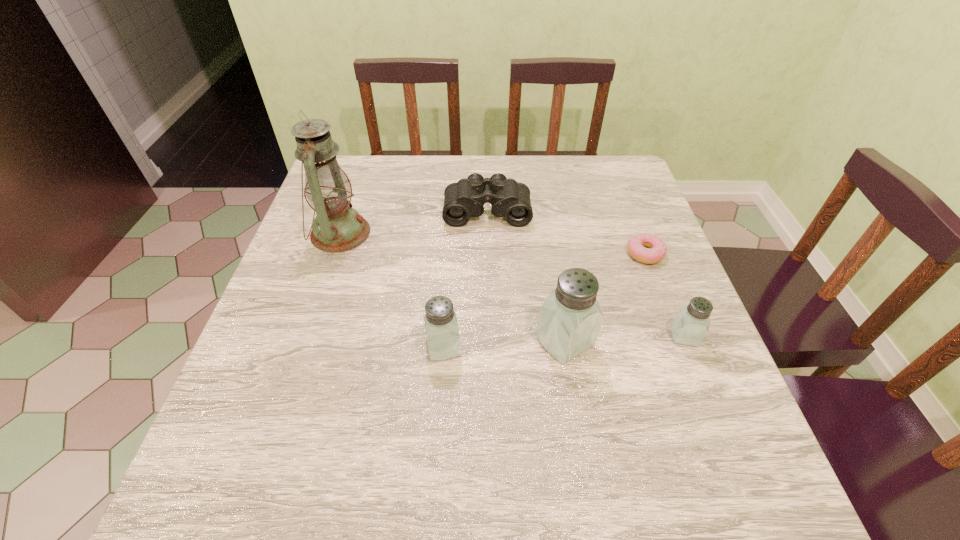
The width and height of the screenshot is (960, 540). Identify the location of vacant area that lies between the tallest saltshaker and the second shortest saltshaker. (504, 344).

This screenshot has width=960, height=540. In order to click on empty location between the shortest object and the oil lamp in this screenshot , I will do `click(492, 244)`.

This screenshot has height=540, width=960. What are the coordinates of `vacant space in between the binoculars and the doughnut` in the screenshot? It's located at (566, 232).

Where is `free space between the second saltshaker from left to right and the leftmost saltshaker`? Image resolution: width=960 pixels, height=540 pixels. free space between the second saltshaker from left to right and the leftmost saltshaker is located at coordinates (504, 344).

Where is `vacant region between the tallest saltshaker and the rightmost saltshaker`? The image size is (960, 540). vacant region between the tallest saltshaker and the rightmost saltshaker is located at coordinates (625, 339).

Locate which object ranks fifth in proximity to the second shortest saltshaker. Please provide its 2D coordinates. Your answer should be formatted as a tuple, i.e. [(x, y)], where the tuple contains the x and y coordinates of a point satisfying the conditions above.

[(636, 245)]

Where is `object that ranks as the closest to the tallest object`? Image resolution: width=960 pixels, height=540 pixels. object that ranks as the closest to the tallest object is located at coordinates (463, 199).

Choose which saltshaker is the nearest neighbor to the shortest saltshaker. Please provide its 2D coordinates. Your answer should be formatted as a tuple, i.e. [(x, y)], where the tuple contains the x and y coordinates of a point satisfying the conditions above.

[(570, 318)]

At what (x,y) coordinates should I click in order to perform the action: click on saltshaker that stands as the second closest to the fourth shortest object. Please return your answer as a coordinate pair (x, y). The image size is (960, 540). Looking at the image, I should click on (691, 324).

Where is `vacant space that satisfies the following two spatial constraints: 1. on the back side of the second saltshaker from right to left; 2. on the right side of the doughnut`? This screenshot has height=540, width=960. vacant space that satisfies the following two spatial constraints: 1. on the back side of the second saltshaker from right to left; 2. on the right side of the doughnut is located at coordinates (551, 254).